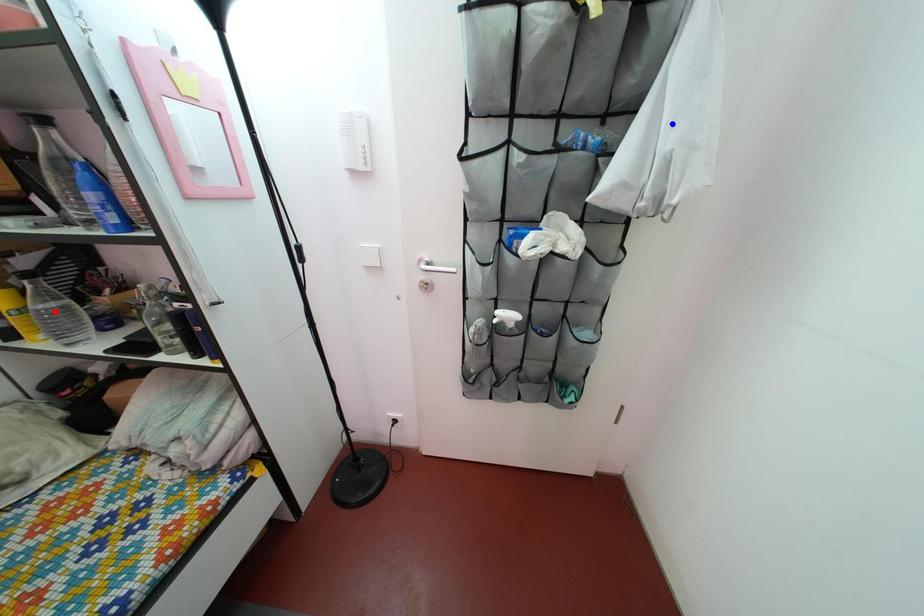
Question: In the image, two points are highlighted. Which point is nearer to the camera? Reply with the corresponding letter.

Choices:
 (A) blue point
 (B) red point

Answer: (A)